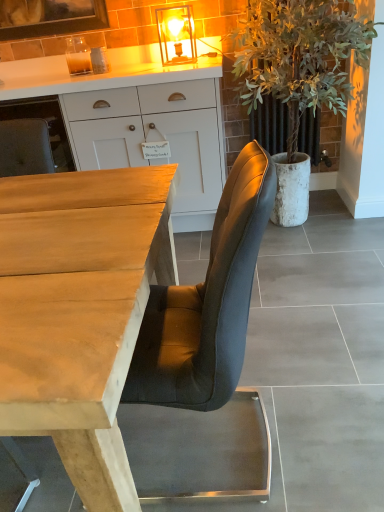
Question: Does wooden desk at center come in front of green leafy plant at right?

Choices:
 (A) yes
 (B) no

Answer: (A)

Question: Is wooden desk at center located outside green leafy plant at right?

Choices:
 (A) yes
 (B) no

Answer: (A)

Question: Does wooden desk at center appear on the right side of green leafy plant at right?

Choices:
 (A) no
 (B) yes

Answer: (A)

Question: From the image's perspective, would you say wooden desk at center is shown under green leafy plant at right?

Choices:
 (A) yes
 (B) no

Answer: (A)

Question: Is green leafy plant at right inside wooden desk at center?

Choices:
 (A) no
 (B) yes

Answer: (A)

Question: From their relative heights in the image, would you say green leafy plant at right is taller or shorter than white matte cabinet at upper center?

Choices:
 (A) tall
 (B) short

Answer: (A)

Question: Is green leafy plant at right inside or outside of white matte cabinet at upper center?

Choices:
 (A) inside
 (B) outside

Answer: (B)

Question: Considering their positions, is green leafy plant at right located in front of or behind white matte cabinet at upper center?

Choices:
 (A) front
 (B) behind

Answer: (A)

Question: In terms of width, does green leafy plant at right look wider or thinner when compared to white matte cabinet at upper center?

Choices:
 (A) thin
 (B) wide

Answer: (A)

Question: Is smooth gray concrete at center inside the boundaries of wooden desk at center, or outside?

Choices:
 (A) inside
 (B) outside

Answer: (A)

Question: Looking at the image, does smooth gray concrete at center seem bigger or smaller compared to wooden desk at center?

Choices:
 (A) big
 (B) small

Answer: (B)

Question: From their relative heights in the image, would you say smooth gray concrete at center is taller or shorter than wooden desk at center?

Choices:
 (A) short
 (B) tall

Answer: (B)

Question: Visually, is smooth gray concrete at center positioned to the left or to the right of wooden desk at center?

Choices:
 (A) left
 (B) right

Answer: (B)

Question: From the image's perspective, relative to smooth gray concrete at center, is white matte cabinet at upper center above or below?

Choices:
 (A) above
 (B) below

Answer: (A)

Question: Looking at the image, does white matte cabinet at upper center seem bigger or smaller compared to smooth gray concrete at center?

Choices:
 (A) small
 (B) big

Answer: (B)